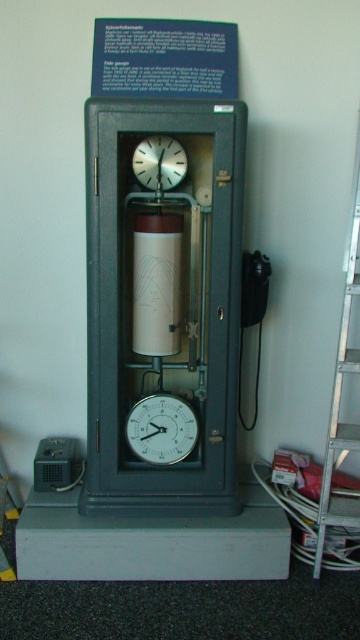
Is silver metallic ladder at right bigger than white metallic clock at upper center?

Yes, silver metallic ladder at right is bigger than white metallic clock at upper center.

Can you confirm if silver metallic ladder at right is positioned to the left of white metallic clock at upper center?

In fact, silver metallic ladder at right is to the right of white metallic clock at upper center.

Between point (327, 461) and point (155, 152), which one is positioned behind?

Point (155, 152)

Where is `silver metallic ladder at right`? This screenshot has height=640, width=360. silver metallic ladder at right is located at coordinates (340, 392).

Consider the image. Measure the distance between point (146, 401) and camera.

A distance of 2.35 meters exists between point (146, 401) and camera.

Who is lower down, white matte clock at center or white metallic clock at upper center?

white matte clock at center is lower down.

Is point (155, 452) closer to viewer compared to point (146, 150)?

No, (155, 452) is behind (146, 150).

The height and width of the screenshot is (640, 360). I want to click on white matte clock at center, so click(162, 428).

Between silver metallic ladder at right and white matte clock at center, which one has less height?

Standing shorter between the two is white matte clock at center.

Does point (356, 529) come closer to viewer compared to point (128, 426)?

No, it is behind (128, 426).

Which is behind, point (356, 252) or point (176, 408)?

Point (176, 408)

At what (x,y) coordinates should I click in order to perform the action: click on silver metallic ladder at right. Please return your answer as a coordinate pair (x, y). Looking at the image, I should click on (340, 392).